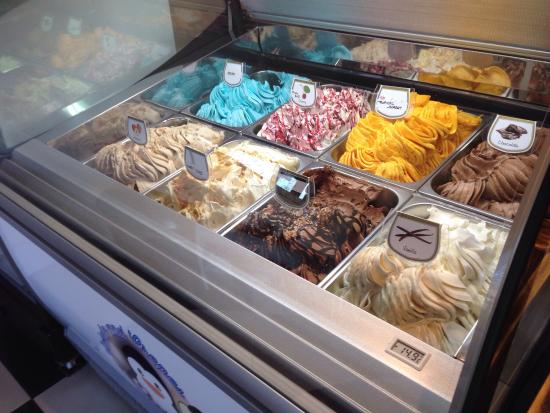
In order to click on checkered floor in this screenshot , I will do `click(68, 401)`.